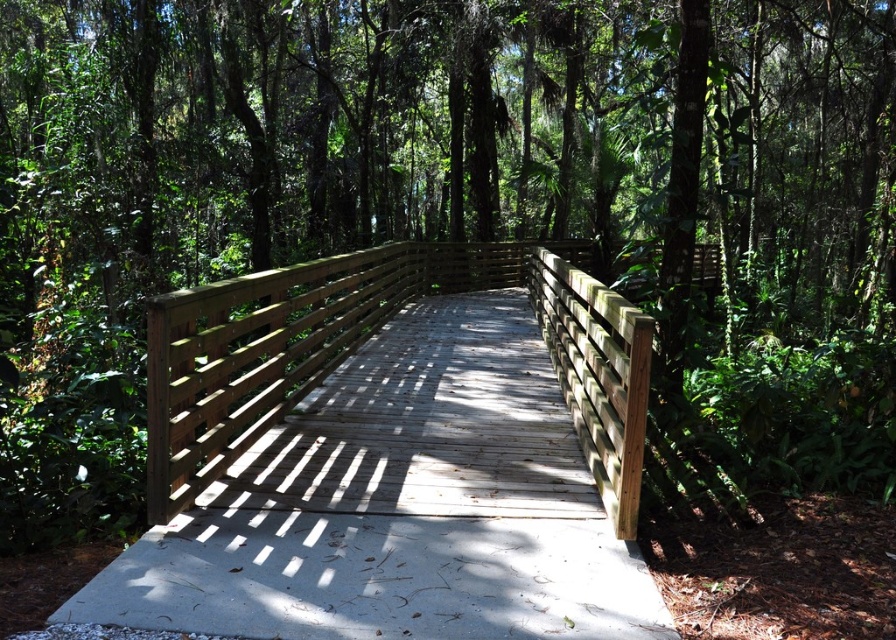
Question: Can you confirm if wooden bridge at center is wider than natural wood fence at center?

Choices:
 (A) no
 (B) yes

Answer: (B)

Question: Does wooden bridge at center have a greater width compared to natural wood fence at center?

Choices:
 (A) yes
 (B) no

Answer: (A)

Question: Which object appears closest to the camera in this image?

Choices:
 (A) natural wood fence at center
 (B) wooden bridge at center

Answer: (B)

Question: Does wooden bridge at center have a lesser width compared to natural wood fence at center?

Choices:
 (A) no
 (B) yes

Answer: (A)

Question: Which point is farther to the camera?

Choices:
 (A) wooden bridge at center
 (B) natural wood fence at center

Answer: (B)